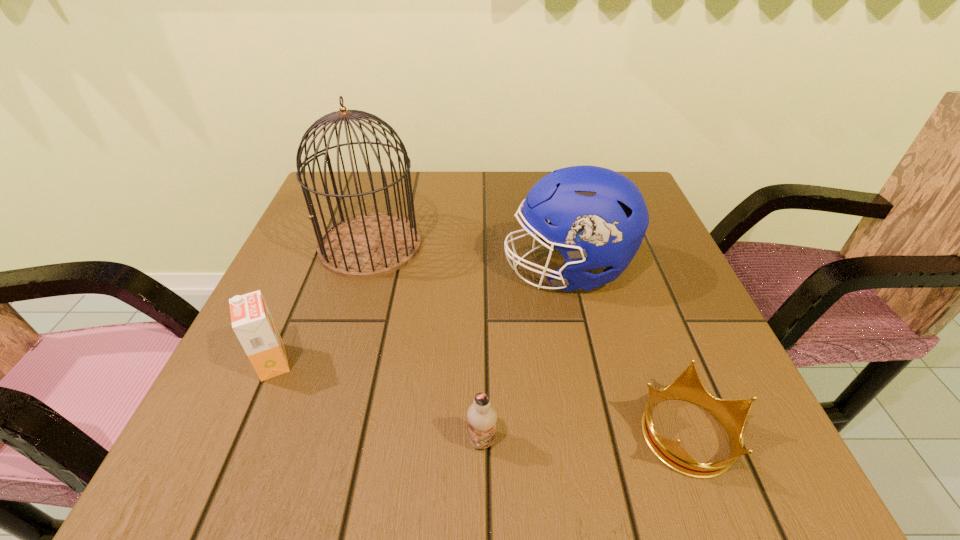
Image resolution: width=960 pixels, height=540 pixels. In order to click on crown that is at the right edge in this screenshot , I will do `click(732, 414)`.

The image size is (960, 540). Find the location of `object located in the far left corner section of the desktop`. object located in the far left corner section of the desktop is located at coordinates (369, 245).

Locate an element on the screen. This screenshot has width=960, height=540. object that is at the near right corner is located at coordinates (732, 414).

You are a GUI agent. You are given a task and a screenshot of the screen. Output one action in this format:
    pyautogui.click(x=<x>, y=<y>)
    Task: Click on the blank area at the far edge
    The width and height of the screenshot is (960, 540).
    Given the screenshot: What is the action you would take?
    pyautogui.click(x=489, y=179)

The image size is (960, 540). In the image, there is a desktop. What are the coordinates of `vacant space at the near edge` in the screenshot? It's located at (625, 431).

You are a GUI agent. You are given a task and a screenshot of the screen. Output one action in this format:
    pyautogui.click(x=<x>, y=<y>)
    Task: Click on the vacant area at the left edge of the desktop
    
    Given the screenshot: What is the action you would take?
    pyautogui.click(x=304, y=268)

At what (x,y) coordinates should I click in order to perform the action: click on vacant space at the right edge of the desktop. Please return your answer as a coordinate pair (x, y). Image resolution: width=960 pixels, height=540 pixels. Looking at the image, I should click on (677, 361).

The height and width of the screenshot is (540, 960). In order to click on free point at the far left corner in this screenshot , I will do `click(367, 179)`.

You are a GUI agent. You are given a task and a screenshot of the screen. Output one action in this format:
    pyautogui.click(x=<x>, y=<y>)
    Task: Click on the vacant region at the near right corner of the desktop
    This screenshot has width=960, height=540.
    Given the screenshot: What is the action you would take?
    pyautogui.click(x=684, y=437)

I want to click on free space between the third object from left to right and the second tallest object, so click(524, 355).